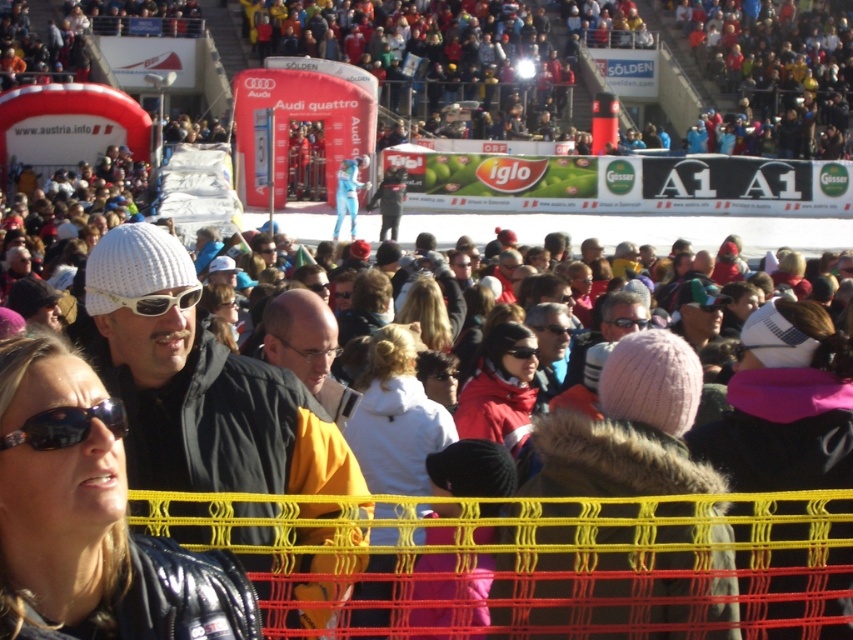
Question: Which of the following is the closest to the observer?

Choices:
 (A) pos(531,324)
 (B) pos(506,349)

Answer: (B)

Question: Can you confirm if white fleece jacket at center is bigger than white matte sunglasses at center?

Choices:
 (A) yes
 (B) no

Answer: (A)

Question: Is the position of red fleece jacket at center less distant than that of black matte sunglasses at center?

Choices:
 (A) yes
 (B) no

Answer: (A)

Question: Is white matte sunglasses at center positioned before black matte sunglasses at center?

Choices:
 (A) yes
 (B) no

Answer: (A)

Question: Estimate the real-world distances between objects in this image. Which object is closer to the shiny black jacket at center?

Choices:
 (A) black matte sunglasses at center
 (B) white matte sunglasses at center

Answer: (B)

Question: Which object appears farthest from the camera in this image?

Choices:
 (A) white fleece jacket at center
 (B) white knit hat at center
 (C) shiny black jacket at center
 (D) black matte goggles at center

Answer: (B)